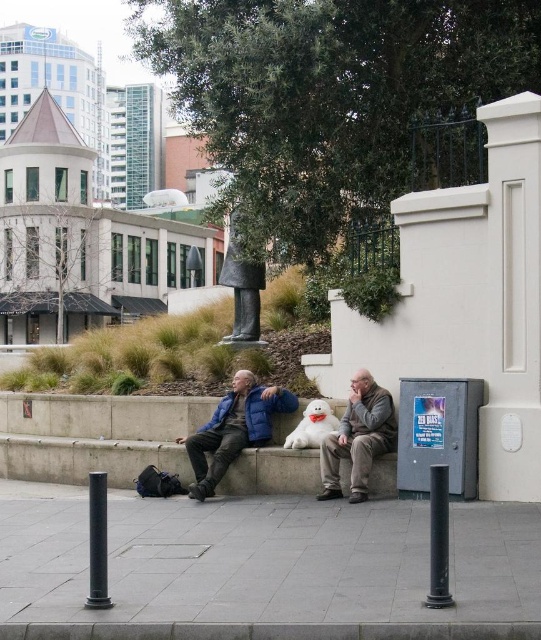
Question: Among these objects, which one is nearest to the camera?

Choices:
 (A) dark gray stone statue at center
 (B) gray woolen sweater at center

Answer: (B)

Question: Which is nearer to the dark gray stone statue at center?

Choices:
 (A) gray concrete pavement at lower center
 (B) gray woolen sweater at center

Answer: (B)

Question: Observing the image, what is the correct spatial positioning of matte blue jacket at center in reference to gray woolen sweater at center?

Choices:
 (A) below
 (B) above

Answer: (A)

Question: Which of the following is the farthest from the observer?

Choices:
 (A) gray woolen sweater at center
 (B) dark gray stone statue at center
 (C) gray concrete pavement at lower center
 (D) matte blue jacket at center

Answer: (B)

Question: Observing the image, what is the correct spatial positioning of matte blue jacket at center in reference to dark gray stone statue at center?

Choices:
 (A) above
 (B) below

Answer: (B)

Question: In this image, where is gray concrete pavement at lower center located relative to gray woolen sweater at center?

Choices:
 (A) above
 (B) below

Answer: (B)